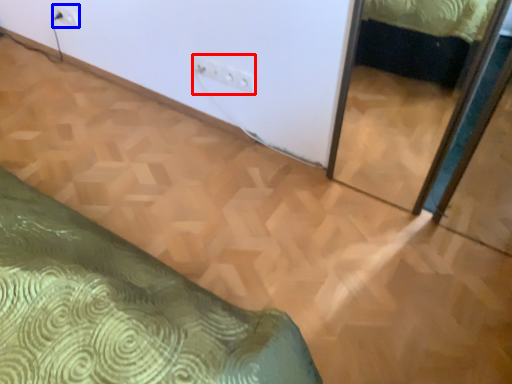
Question: Which point is closer to the camera, electric outlet (highlighted by a red box) or electric outlet (highlighted by a blue box)?

Choices:
 (A) electric outlet
 (B) electric outlet

Answer: (A)